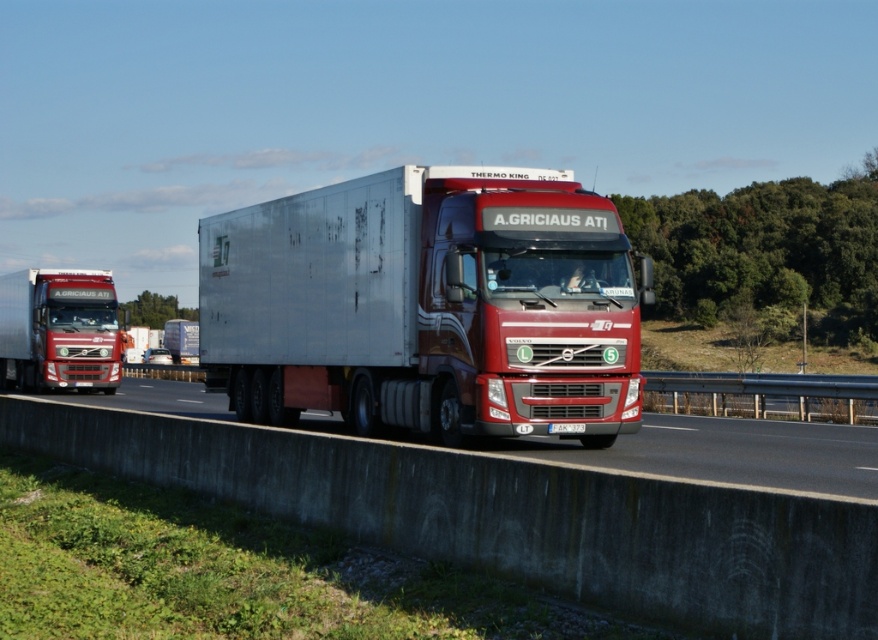
Between point (96, 413) and point (710, 419), which one is positioned behind?

The point (710, 419) is more distant.

Who is higher up, concrete barrier at center or metallic concrete barrier at center?

concrete barrier at center is above.

Is point (657, 609) less distant than point (637, 433)?

Yes, point (657, 609) is closer to viewer.

The image size is (878, 640). I want to click on concrete barrier at center, so click(512, 516).

Does silver metallic trailer truck at center appear over matte red truck at left?

Actually, silver metallic trailer truck at center is below matte red truck at left.

Is silver metallic trailer truck at center shorter than matte red truck at left?

Correct, silver metallic trailer truck at center is not as tall as matte red truck at left.

Between point (517, 381) and point (99, 368), which one is positioned in front?

Point (517, 381)

Find the location of a particular element. The width and height of the screenshot is (878, 640). silver metallic trailer truck at center is located at coordinates (428, 305).

Between concrete barrier at center and matte red truck at left, which one is positioned higher?

matte red truck at left is above.

You are a GUI agent. You are given a task and a screenshot of the screen. Output one action in this format:
    pyautogui.click(x=<x>, y=<y>)
    Task: Click on the concrete barrier at center
    
    Given the screenshot: What is the action you would take?
    pyautogui.click(x=512, y=516)